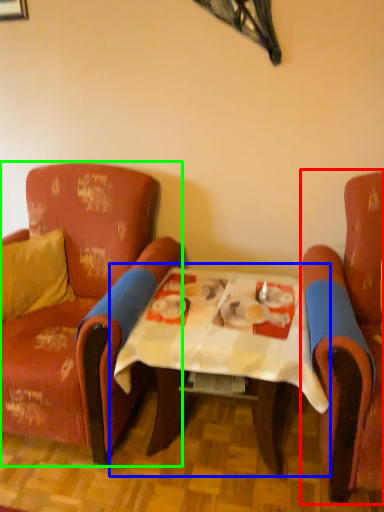
Question: Considering the real-world distances, which object is closest to chair (highlighted by a red box)? table (highlighted by a blue box) or chair (highlighted by a green box).

Choices:
 (A) table
 (B) chair

Answer: (A)